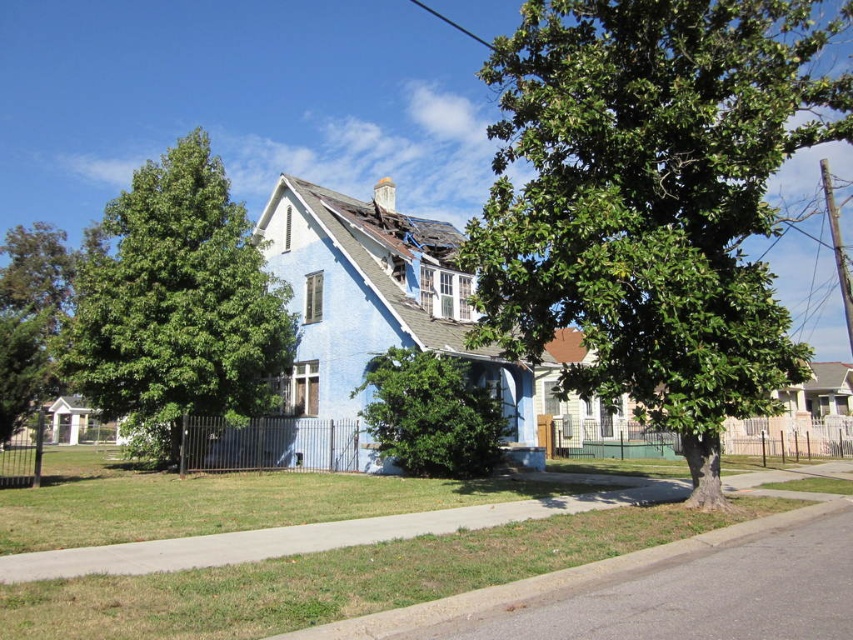
Question: Which point is closer to the camera?

Choices:
 (A) green leafy tree at left
 (B) green leafy tree at lower left
 (C) green leafy tree at center
 (D) green leafy bush at center

Answer: (C)

Question: Where is green leafy tree at center located in relation to green leafy bush at center in the image?

Choices:
 (A) above
 (B) below

Answer: (A)

Question: Estimate the real-world distances between objects in this image. Which object is farther from the green leafy bush at center?

Choices:
 (A) green leafy tree at left
 (B) green leafy tree at center
 (C) green leafy tree at lower left

Answer: (C)

Question: Among these objects, which one is farthest from the camera?

Choices:
 (A) green leafy tree at left
 (B) green leafy tree at center
 (C) green leafy bush at center
 (D) green leafy tree at lower left

Answer: (A)

Question: From the image, what is the correct spatial relationship of green leafy bush at center in relation to green leafy tree at lower left?

Choices:
 (A) above
 (B) below

Answer: (B)

Question: Is green leafy tree at center below green leafy tree at lower left?

Choices:
 (A) yes
 (B) no

Answer: (B)